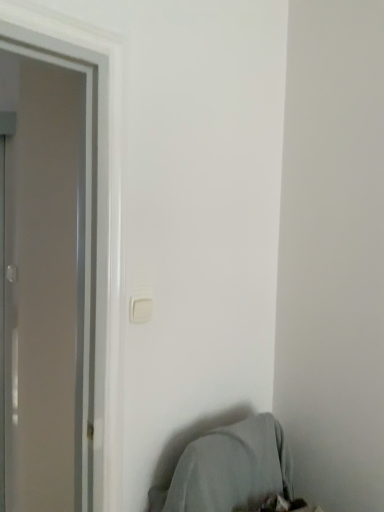
Question: In the image, is white plastic light switch at center positioned in front of or behind gray fabric bean bag chair at lower right?

Choices:
 (A) front
 (B) behind

Answer: (B)

Question: From a real-world perspective, relative to gray fabric bean bag chair at lower right, is white plastic light switch at center vertically above or below?

Choices:
 (A) above
 (B) below

Answer: (A)

Question: Would you say white plastic light switch at center is to the left or to the right of gray fabric bean bag chair at lower right in the picture?

Choices:
 (A) right
 (B) left

Answer: (B)

Question: Would you say gray fabric bean bag chair at lower right is to the left or to the right of white plastic light switch at center in the picture?

Choices:
 (A) left
 (B) right

Answer: (B)

Question: Considering the positions of gray fabric bean bag chair at lower right and white plastic light switch at center in the image, is gray fabric bean bag chair at lower right wider or thinner than white plastic light switch at center?

Choices:
 (A) thin
 (B) wide

Answer: (B)

Question: Considering the positions of point (279, 467) and point (135, 315), is point (279, 467) closer or farther from the camera than point (135, 315)?

Choices:
 (A) farther
 (B) closer

Answer: (A)

Question: Considering their positions, is gray fabric bean bag chair at lower right located in front of or behind white plastic light switch at center?

Choices:
 (A) front
 (B) behind

Answer: (A)